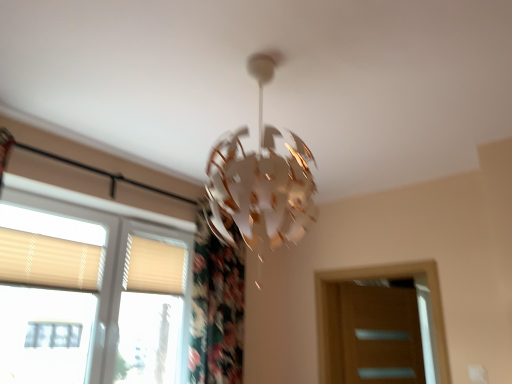
Question: Can you confirm if beige fabric shutter at lower left, the first shutter in the right-to-left sequence, is positioned to the right of beige textured blinds at left?

Choices:
 (A) yes
 (B) no

Answer: (A)

Question: From the image's perspective, does beige fabric shutter at lower left, positioned as the 2th shutter in left-to-right order, appear lower than beige textured blinds at left?

Choices:
 (A) yes
 (B) no

Answer: (B)

Question: Does beige fabric shutter at lower left, the second shutter positioned from the front, have a lesser width compared to beige textured blinds at left?

Choices:
 (A) no
 (B) yes

Answer: (B)

Question: From the image's perspective, is beige fabric shutter at lower left, the 1th shutter in the back-to-front sequence, on beige textured blinds at left?

Choices:
 (A) yes
 (B) no

Answer: (A)

Question: From a real-world perspective, is beige fabric shutter at lower left, the second shutter positioned from the front, over beige textured blinds at left?

Choices:
 (A) no
 (B) yes

Answer: (B)

Question: Are beige fabric shutter at lower left, the second shutter positioned from the front, and beige textured blinds at left located far from each other?

Choices:
 (A) yes
 (B) no

Answer: (B)

Question: Does beige textured blinds at left contain beige fabric shutter at lower left, the first shutter in the right-to-left sequence?

Choices:
 (A) no
 (B) yes

Answer: (B)

Question: Is beige fabric shutter at lower left, the first shutter in the right-to-left sequence, at the back of beige textured blinds at left?

Choices:
 (A) yes
 (B) no

Answer: (A)

Question: Does beige textured blinds at left have a greater height compared to beige fabric shutter at lower left, positioned as the 2th shutter in left-to-right order?

Choices:
 (A) no
 (B) yes

Answer: (B)

Question: Is beige textured blinds at left next to beige fabric shutter at lower left, the first shutter in the right-to-left sequence, and touching it?

Choices:
 (A) yes
 (B) no

Answer: (B)

Question: From a real-world perspective, is beige textured blinds at left under beige fabric shutter at lower left, the 1th shutter in the back-to-front sequence?

Choices:
 (A) no
 (B) yes

Answer: (B)

Question: From a real-world perspective, is beige textured blinds at left positioned over beige fabric shutter at lower left, positioned as the 2th shutter in left-to-right order, based on gravity?

Choices:
 (A) no
 (B) yes

Answer: (A)

Question: Is beige fabric shutter at left, the 1th shutter viewed from the left, completely or partially inside beige fabric shutter at lower left, positioned as the 2th shutter in left-to-right order?

Choices:
 (A) yes
 (B) no

Answer: (B)